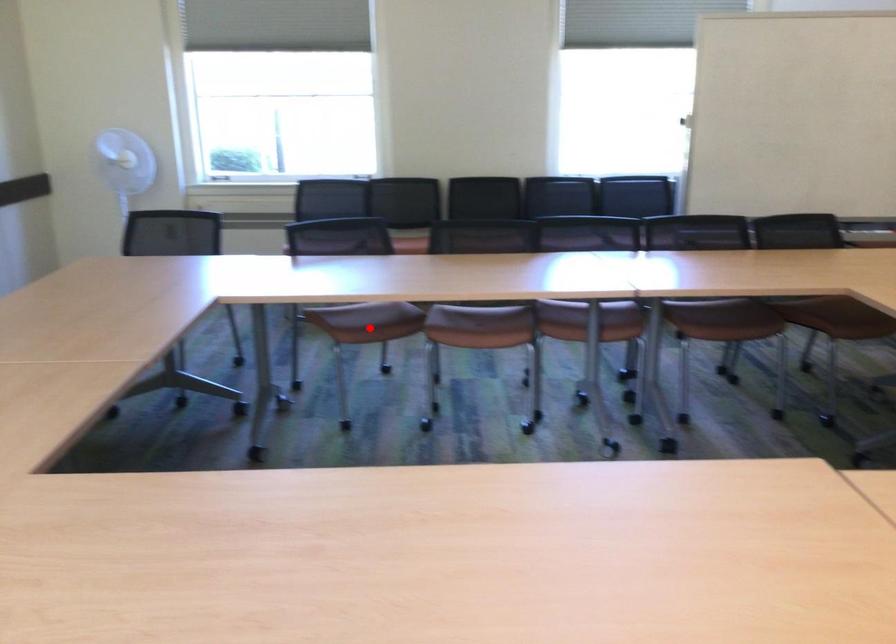
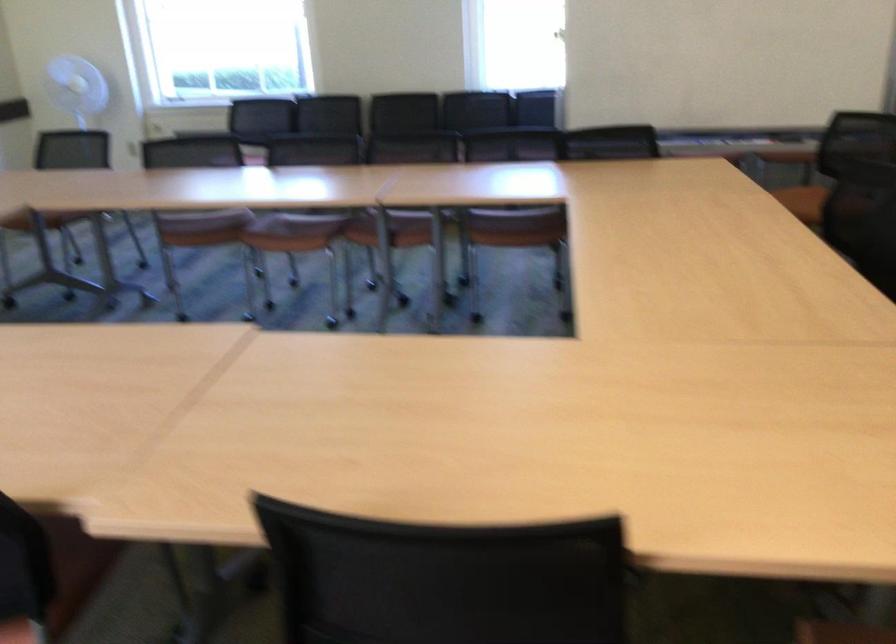
Question: A red point is marked in image1. In image2, is the corresponding 3D point closer to the camera or farther? Reply with the corresponding letter.

Choices:
 (A) The corresponding 3D point is closer.
 (B) The corresponding 3D point is farther.

Answer: (B)